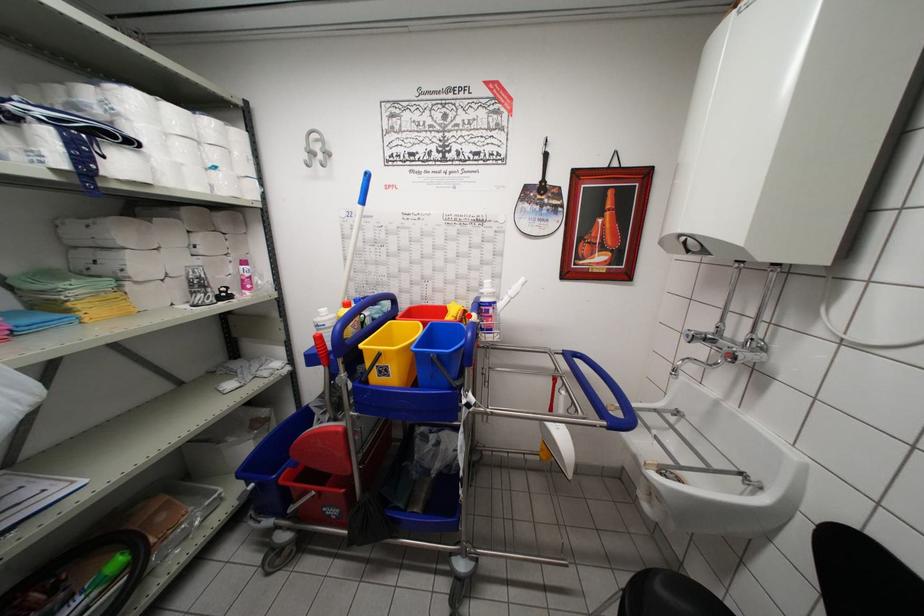
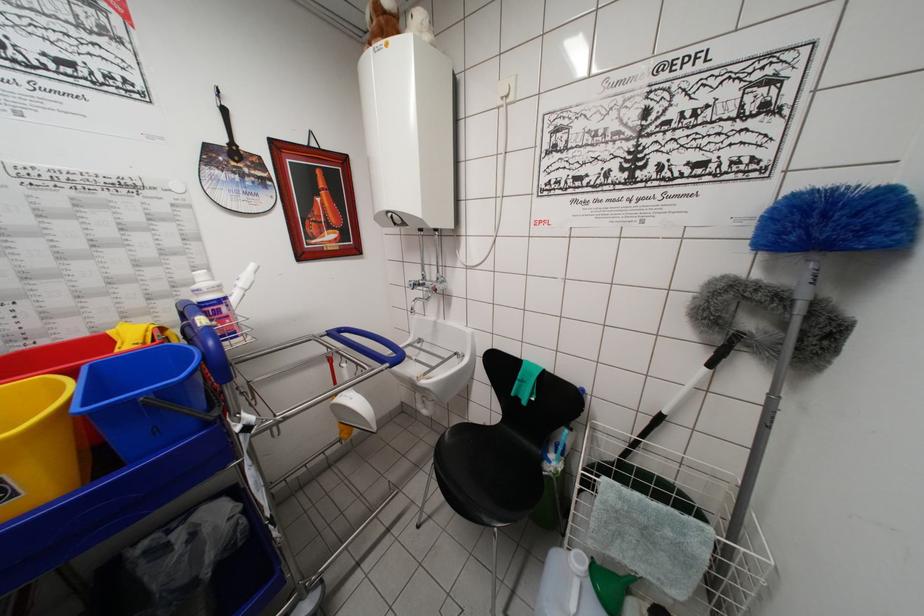
Locate, in the second image, the point that corresponds to the highlighted location in the first image.

(165, 333)